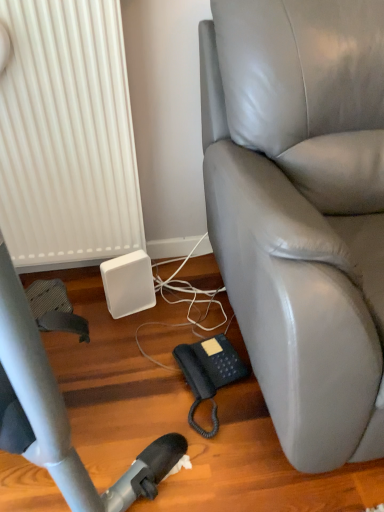
Question: Considering the relative positions of black rubberized phone at lower center and white matte speaker at lower left in the image provided, is black rubberized phone at lower center in front of white matte speaker at lower left?

Choices:
 (A) no
 (B) yes

Answer: (B)

Question: Is white matte speaker at lower left at the back of black rubberized phone at lower center?

Choices:
 (A) no
 (B) yes

Answer: (B)

Question: Can we say black rubberized phone at lower center lies outside white matte speaker at lower left?

Choices:
 (A) no
 (B) yes

Answer: (B)

Question: Does black rubberized phone at lower center appear on the right side of white matte speaker at lower left?

Choices:
 (A) no
 (B) yes

Answer: (B)

Question: Considering the relative sizes of black rubberized phone at lower center and white matte speaker at lower left in the image provided, is black rubberized phone at lower center bigger than white matte speaker at lower left?

Choices:
 (A) yes
 (B) no

Answer: (A)

Question: Is white ribbed radiator at lower left inside the boundaries of gray leather chair at right, or outside?

Choices:
 (A) inside
 (B) outside

Answer: (B)

Question: In the image, is white ribbed radiator at lower left on the left side or the right side of gray leather chair at right?

Choices:
 (A) left
 (B) right

Answer: (A)

Question: Relative to gray leather chair at right, is white ribbed radiator at lower left in front or behind?

Choices:
 (A) behind
 (B) front

Answer: (A)

Question: Considering the positions of white ribbed radiator at lower left and gray leather chair at right in the image, is white ribbed radiator at lower left taller or shorter than gray leather chair at right?

Choices:
 (A) short
 (B) tall

Answer: (A)

Question: In terms of size, does white matte speaker at lower left appear bigger or smaller than gray leather chair at right?

Choices:
 (A) big
 (B) small

Answer: (B)

Question: From a real-world perspective, is white matte speaker at lower left positioned above or below gray leather chair at right?

Choices:
 (A) above
 (B) below

Answer: (B)

Question: From the image's perspective, is white matte speaker at lower left located above or below gray leather chair at right?

Choices:
 (A) below
 (B) above

Answer: (A)

Question: Is white matte speaker at lower left taller or shorter than gray leather chair at right?

Choices:
 (A) tall
 (B) short

Answer: (B)

Question: Considering the positions of point coord(26,52) and point coord(226,352), is point coord(26,52) closer or farther from the camera than point coord(226,352)?

Choices:
 (A) closer
 (B) farther

Answer: (A)

Question: Is white ribbed radiator at lower left wider or thinner than black rubberized phone at lower center?

Choices:
 (A) thin
 (B) wide

Answer: (A)